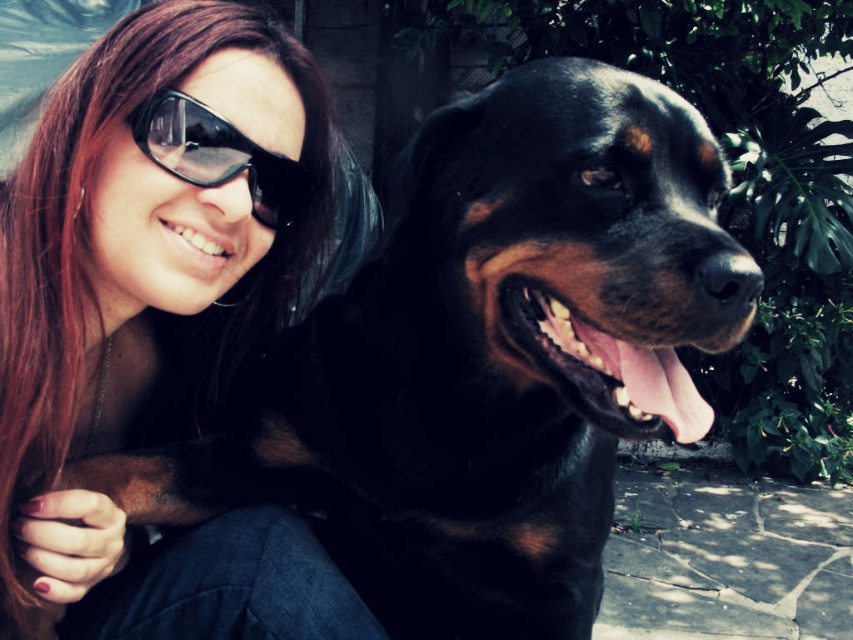
Does point (264, 45) come in front of point (238, 147)?

No, (264, 45) is behind (238, 147).

Between matte black hair at upper left and black plastic goggles at upper left, which one has more height?

matte black hair at upper left

What do you see at coordinates (157, 324) in the screenshot?
I see `matte black hair at upper left` at bounding box center [157, 324].

At what (x,y) coordinates should I click in order to perform the action: click on matte black hair at upper left. Please return your answer as a coordinate pair (x, y). This screenshot has width=853, height=640. Looking at the image, I should click on (157, 324).